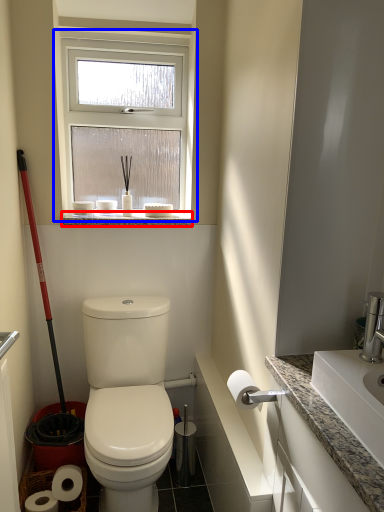
Question: Which of the following is the closest to the observer, window sill (highlighted by a red box) or window (highlighted by a blue box)?

Choices:
 (A) window sill
 (B) window

Answer: (B)